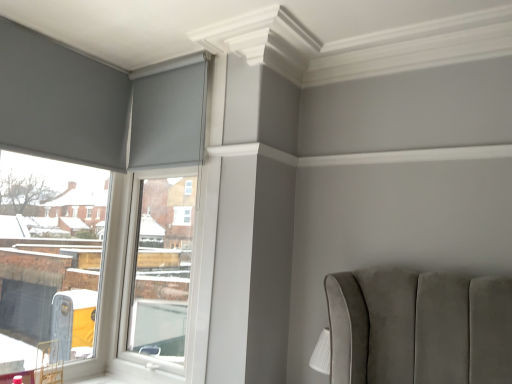
This screenshot has width=512, height=384. What do you see at coordinates (169, 113) in the screenshot?
I see `matte gray curtain at upper left` at bounding box center [169, 113].

Describe the element at coordinates (54, 261) in the screenshot. I see `matte gray roller blind at upper left` at that location.

Locate an element on the screen. matte gray curtain at upper left is located at coordinates (169, 113).

Consider the image. Is matte gray roller blind at upper left aimed at matte gray curtain at upper left?

Yes, matte gray roller blind at upper left is oriented towards matte gray curtain at upper left.

Which is more to the right, matte gray roller blind at upper left or matte gray curtain at upper left?

matte gray curtain at upper left is more to the right.

From the image's perspective, would you say matte gray roller blind at upper left is positioned over matte gray curtain at upper left?

No, from the image's perspective, matte gray roller blind at upper left is not over matte gray curtain at upper left.

From a real-world perspective, is white plastic window frame at upper left positioned over matte gray curtain at upper left based on gravity?

Actually, white plastic window frame at upper left is physically below matte gray curtain at upper left in the real world.

Is white plastic window frame at upper left facing away from matte gray curtain at upper left?

Correct, white plastic window frame at upper left is looking away from matte gray curtain at upper left.

In the image, is white plastic window frame at upper left on the left side or the right side of matte gray curtain at upper left?

white plastic window frame at upper left is to the right of matte gray curtain at upper left.

Is point (137, 153) farther from viewer compared to point (193, 150)?

Yes, point (137, 153) is behind point (193, 150).

Does white plastic window frame at upper left have a lesser width compared to matte gray roller blind at upper left?

Correct, the width of white plastic window frame at upper left is less than that of matte gray roller blind at upper left.

From a real-world perspective, is white plastic window frame at upper left beneath matte gray roller blind at upper left?

Yes, from a real-world perspective, white plastic window frame at upper left is beneath matte gray roller blind at upper left.

Consider the image. Is white plastic window frame at upper left located outside matte gray roller blind at upper left?

That's correct, white plastic window frame at upper left is outside of matte gray roller blind at upper left.

Which object is further away from the camera taking this photo, white plastic window frame at upper left or matte gray roller blind at upper left?

white plastic window frame at upper left is more distant.

Which is correct: matte gray curtain at upper left is inside matte gray roller blind at upper left, or outside of it?

The correct answer is: outside.

How far apart are matte gray curtain at upper left and matte gray roller blind at upper left?

matte gray curtain at upper left is 28.20 inches from matte gray roller blind at upper left.

Considering the relative sizes of matte gray curtain at upper left and matte gray roller blind at upper left in the image provided, is matte gray curtain at upper left shorter than matte gray roller blind at upper left?

Yes.

Can you confirm if matte gray curtain at upper left is thinner than matte gray roller blind at upper left?

Correct, the width of matte gray curtain at upper left is less than that of matte gray roller blind at upper left.

This screenshot has width=512, height=384. I want to click on window in front of the white plastic window frame at upper left, so click(54, 261).

Is matte gray roller blind at upper left positioned far away from white plastic window frame at upper left?

They are positioned close to each other.

In the scene shown: Is matte gray roller blind at upper left not within white plastic window frame at upper left?

Yes, matte gray roller blind at upper left is located beyond the bounds of white plastic window frame at upper left.

Can you tell me how much matte gray roller blind at upper left and white plastic window frame at upper left differ in facing direction?

matte gray roller blind at upper left and white plastic window frame at upper left are facing 89.1 degrees away from each other.

Considering the sizes of objects matte gray curtain at upper left and white plastic window frame at upper left in the image provided, who is smaller, matte gray curtain at upper left or white plastic window frame at upper left?

matte gray curtain at upper left.

Is matte gray curtain at upper left wider or thinner than white plastic window frame at upper left?

Clearly, matte gray curtain at upper left has less width compared to white plastic window frame at upper left.

Based on the photo, is matte gray curtain at upper left taller or shorter than white plastic window frame at upper left?

Clearly, matte gray curtain at upper left is shorter compared to white plastic window frame at upper left.

Locate an element on the screen. This screenshot has height=384, width=512. window frame below the matte gray curtain at upper left (from a real-world perspective) is located at coordinates (163, 203).

The width and height of the screenshot is (512, 384). Find the location of `window that appears below the matte gray curtain at upper left (from the image's perspective)`. window that appears below the matte gray curtain at upper left (from the image's perspective) is located at coordinates 54,261.

The height and width of the screenshot is (384, 512). I want to click on curtain above the white plastic window frame at upper left (from a real-world perspective), so click(x=169, y=113).

Considering their positions, is matte gray curtain at upper left positioned further to matte gray roller blind at upper left than white plastic window frame at upper left?

Among the two, matte gray curtain at upper left is located further to matte gray roller blind at upper left.

When comparing their distances from white plastic window frame at upper left, does matte gray curtain at upper left or matte gray roller blind at upper left seem further?

Among the two, matte gray roller blind at upper left is located further to white plastic window frame at upper left.

Estimate the real-world distances between objects in this image. Which object is closer to matte gray curtain at upper left, matte gray roller blind at upper left or white plastic window frame at upper left?

The object closer to matte gray curtain at upper left is white plastic window frame at upper left.

Which object lies nearer to the anchor point matte gray curtain at upper left, white plastic window frame at upper left or matte gray roller blind at upper left?

white plastic window frame at upper left lies closer to matte gray curtain at upper left than the other object.

Considering their positions, is matte gray roller blind at upper left positioned closer to white plastic window frame at upper left than matte gray curtain at upper left?

matte gray curtain at upper left lies closer to white plastic window frame at upper left than the other object.

From the image, which object appears to be farther from matte gray roller blind at upper left, white plastic window frame at upper left or matte gray curtain at upper left?

Based on the image, matte gray curtain at upper left appears to be further to matte gray roller blind at upper left.

Image resolution: width=512 pixels, height=384 pixels. Find the location of `window between matte gray curtain at upper left and white plastic window frame at upper left vertically`. window between matte gray curtain at upper left and white plastic window frame at upper left vertically is located at coordinates (54, 261).